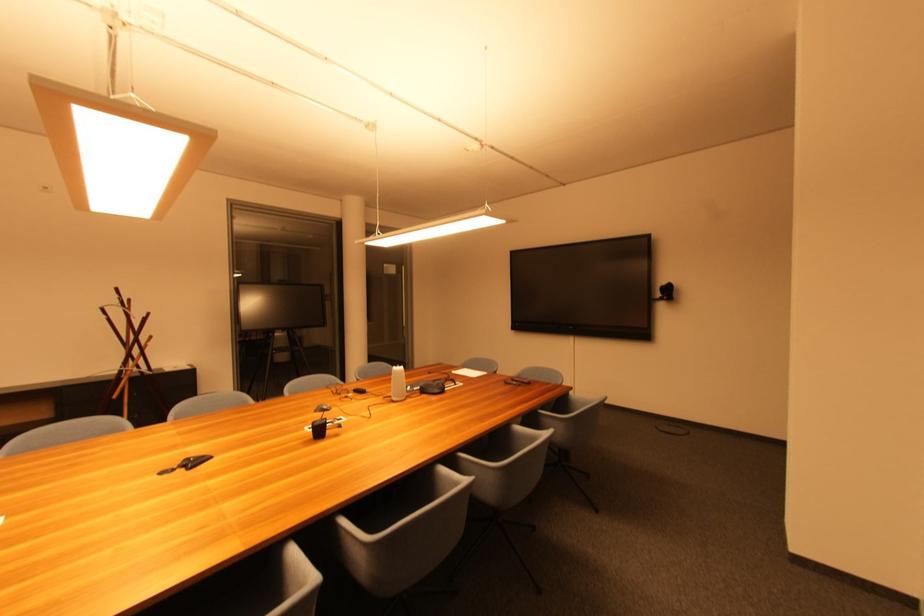
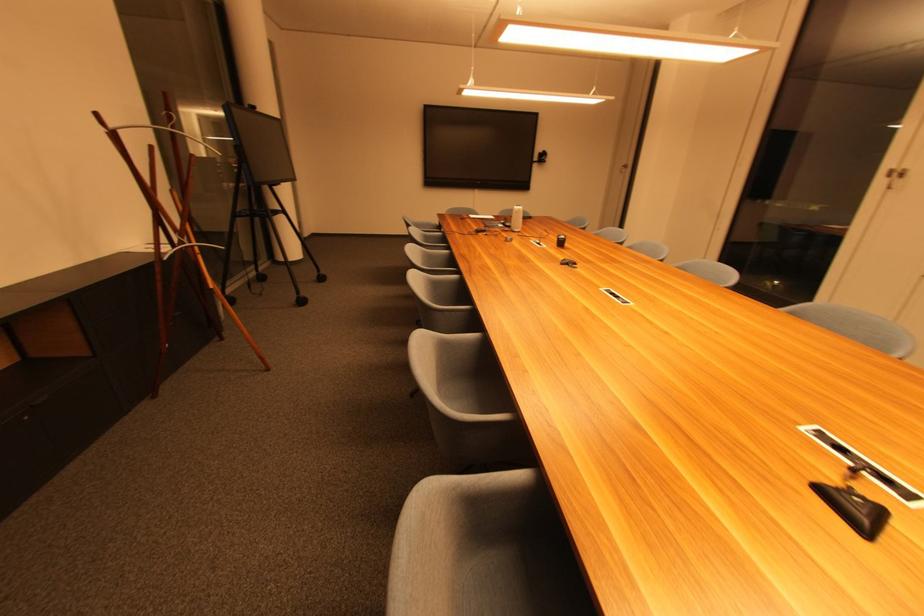
Locate, in the second image, the point that corresponds to (x=120, y=400) in the first image.

(216, 288)